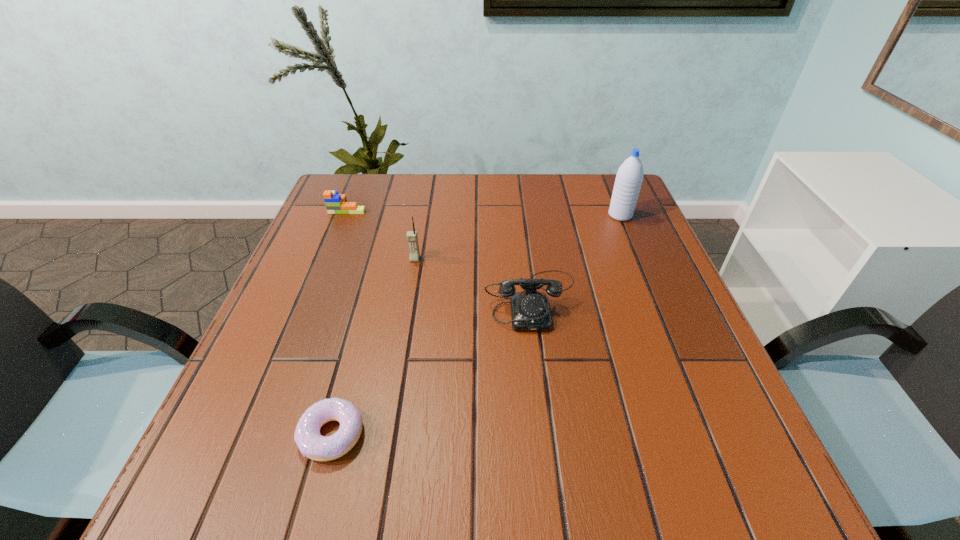
Identify the location of water bottle. (629, 177).

This screenshot has height=540, width=960. What are the coordinates of `the tallest object` in the screenshot? It's located at (629, 177).

Image resolution: width=960 pixels, height=540 pixels. I want to click on the second tallest object, so click(412, 237).

The width and height of the screenshot is (960, 540). Find the location of `the third farthest object`. the third farthest object is located at coordinates (412, 237).

Where is `the second object from right to left`? The width and height of the screenshot is (960, 540). the second object from right to left is located at coordinates (530, 312).

Find the location of a particular element. The height and width of the screenshot is (540, 960). the third shortest object is located at coordinates (530, 312).

I want to click on Lego, so 335,203.

Where is `the leftmost object`? The height and width of the screenshot is (540, 960). the leftmost object is located at coordinates (335, 203).

Where is `the shortest object`? Image resolution: width=960 pixels, height=540 pixels. the shortest object is located at coordinates (311, 443).

The image size is (960, 540). What are the coordinates of `doughnut` in the screenshot? It's located at point(311,443).